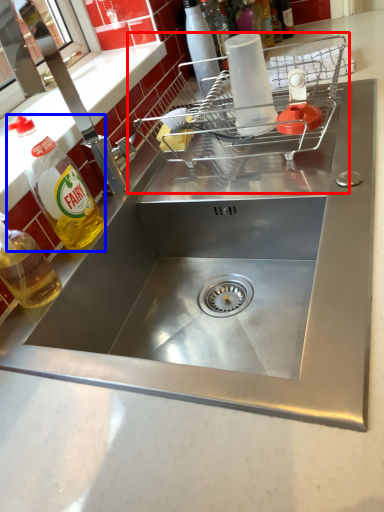
Question: Which of the following is the closest to the observer, appliance (highlighted by a red box) or bottle (highlighted by a blue box)?

Choices:
 (A) appliance
 (B) bottle

Answer: (B)